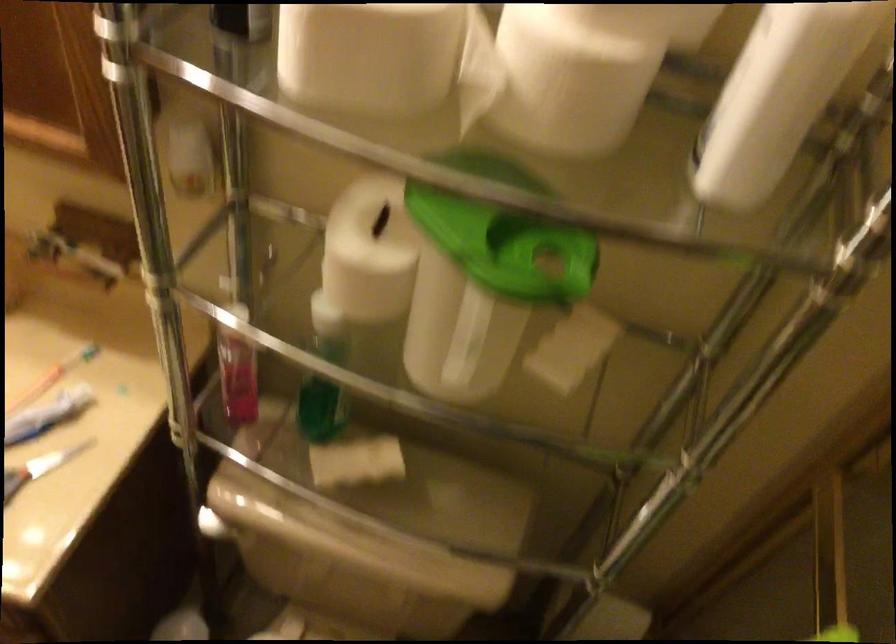
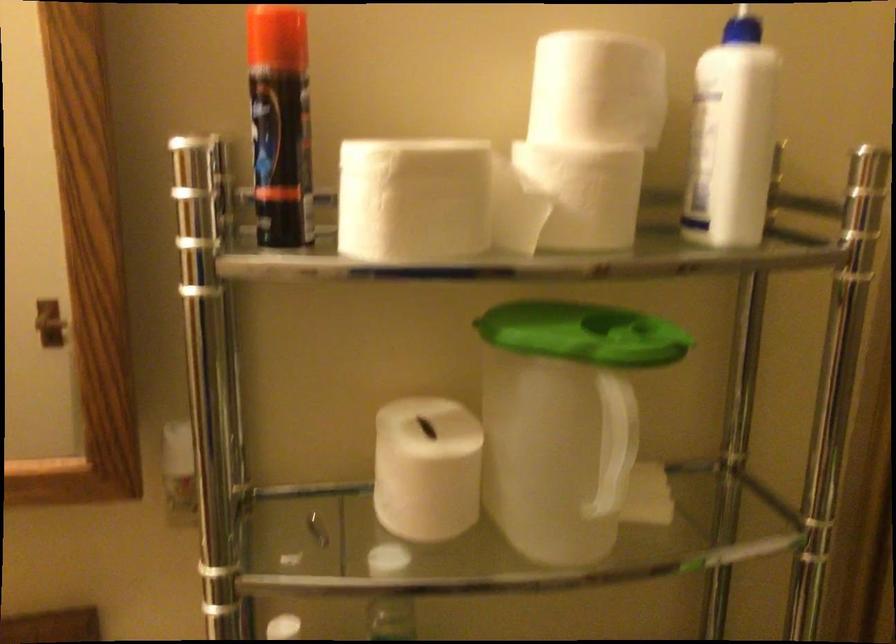
Where in the second image is the point corresponding to pixel 463 216 from the first image?

(563, 327)